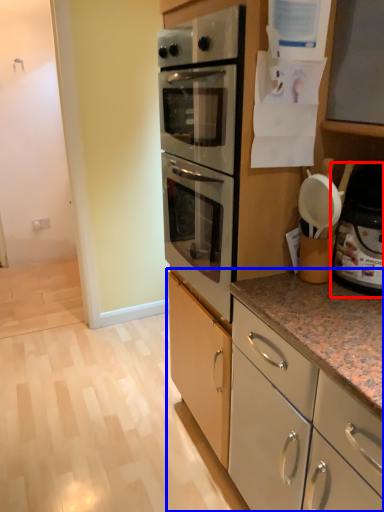
Question: Which object is closer to the camera taking this photo, appliance (highlighted by a red box) or cabinetry (highlighted by a blue box)?

Choices:
 (A) appliance
 (B) cabinetry

Answer: (A)